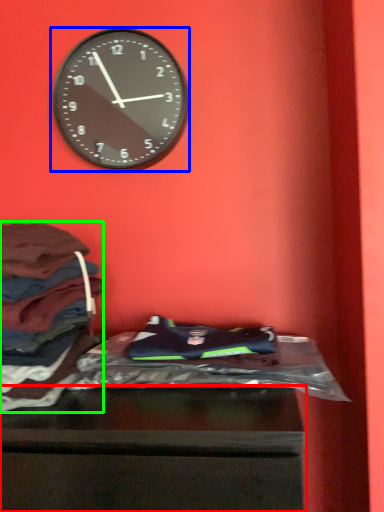
Question: Considering the real-world distances, which object is farthest from furniture (highlighted by a red box)? wall clock (highlighted by a blue box) or clothing (highlighted by a green box)?

Choices:
 (A) wall clock
 (B) clothing

Answer: (A)